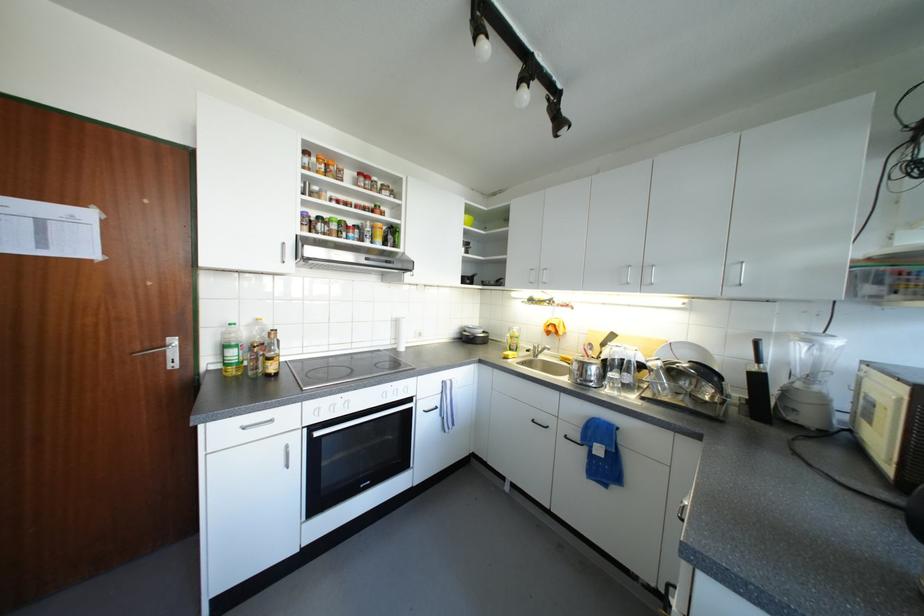
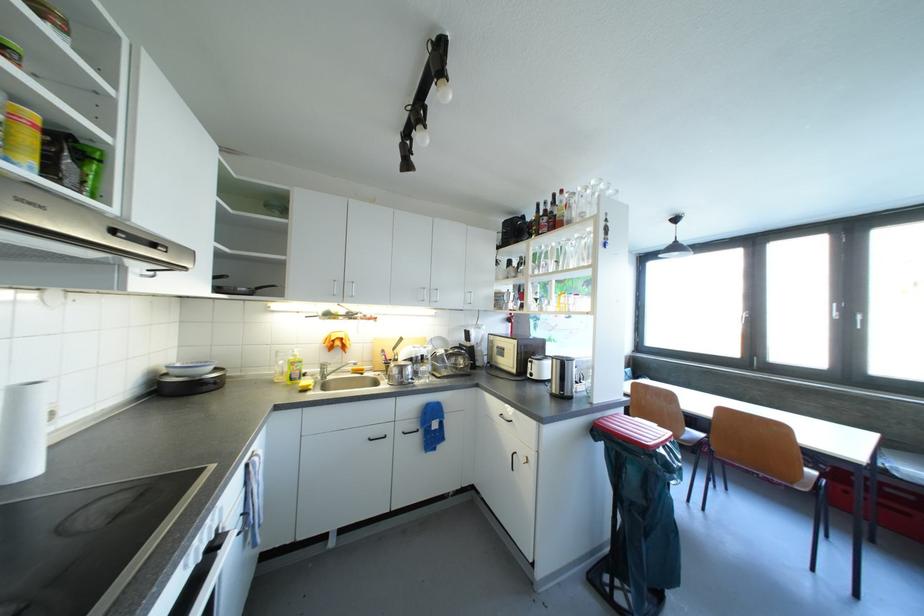
Find the pixel in the second image that matches point 512,342 in the first image.

(283, 371)